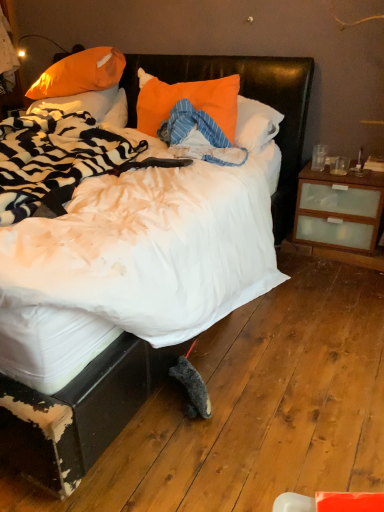
Question: Is orange fabric pillow at upper left, the second pillow viewed from the right, to the left or to the right of orange fabric pillow at center, the third pillow positioned from the left, in the image?

Choices:
 (A) right
 (B) left

Answer: (B)

Question: In the image, is orange fabric pillow at upper left, which appears as the second pillow when viewed from the left, positioned in front of or behind orange fabric pillow at center, which is the 1th pillow from right to left?

Choices:
 (A) behind
 (B) front

Answer: (A)

Question: Based on their relative distances, which object is farther from the orange fabric pillow at upper left, the third pillow from the right?

Choices:
 (A) orange fabric pillow at center, which is the 1th pillow from right to left
 (B) white soft bed at center
 (C) orange fabric pillow at upper left, the second pillow viewed from the right

Answer: (B)

Question: Considering the real-world distances, which object is farthest from the orange fabric pillow at center, which is the 1th pillow from right to left?

Choices:
 (A) orange fabric pillow at upper left, positioned as the 1th pillow in left-to-right order
 (B) orange fabric pillow at upper left, which appears as the second pillow when viewed from the left
 (C) white soft bed at center

Answer: (B)